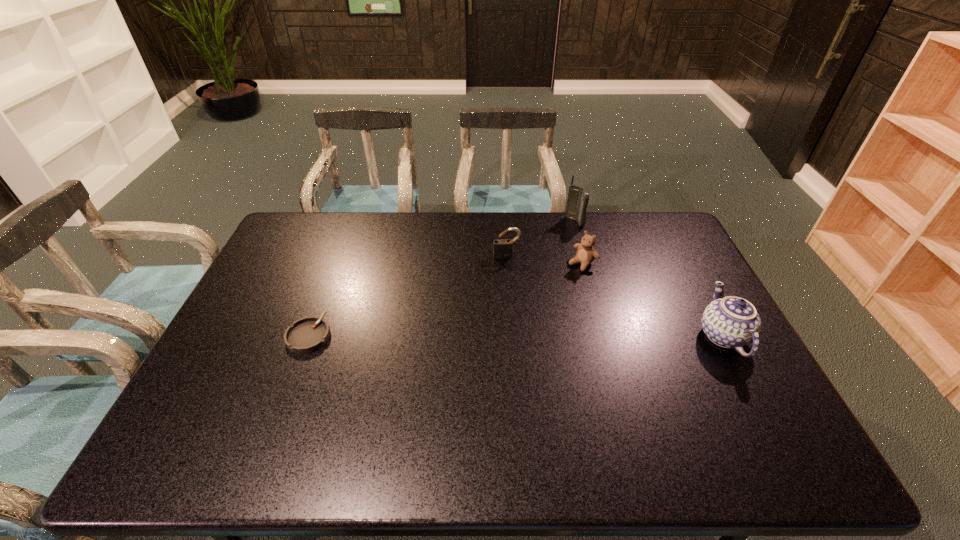
Image resolution: width=960 pixels, height=540 pixels. I want to click on ashtray, so click(308, 334).

You are a GUI agent. You are given a task and a screenshot of the screen. Output one action in this format:
    pyautogui.click(x=<x>, y=<y>)
    Task: Click on the leftmost object
    This screenshot has width=960, height=540.
    Given the screenshot: What is the action you would take?
    pyautogui.click(x=308, y=334)

Find the location of `chinaware`. chinaware is located at coordinates (730, 322).

You are a GUI agent. You are given a task and a screenshot of the screen. Output one action in this format:
    pyautogui.click(x=<x>, y=<y>)
    Task: Click on the rightmost object
    The image size is (960, 540).
    Given the screenshot: What is the action you would take?
    pyautogui.click(x=730, y=322)

Find the location of a particular element. The image size is (960, 540). padlock is located at coordinates 502,248.

Locate an element on the screen. teddy bear is located at coordinates (586, 253).

The image size is (960, 540). Identify the location of the tallest object. (578, 198).

Identify the location of the farthest object. (578, 198).

Locate an element on the screen. vacant space positioned 0.340m on the right of the ashtray is located at coordinates (448, 335).

Where is `free location located 0.370m with the keyhole on the front of the padlock`? The image size is (960, 540). free location located 0.370m with the keyhole on the front of the padlock is located at coordinates (521, 341).